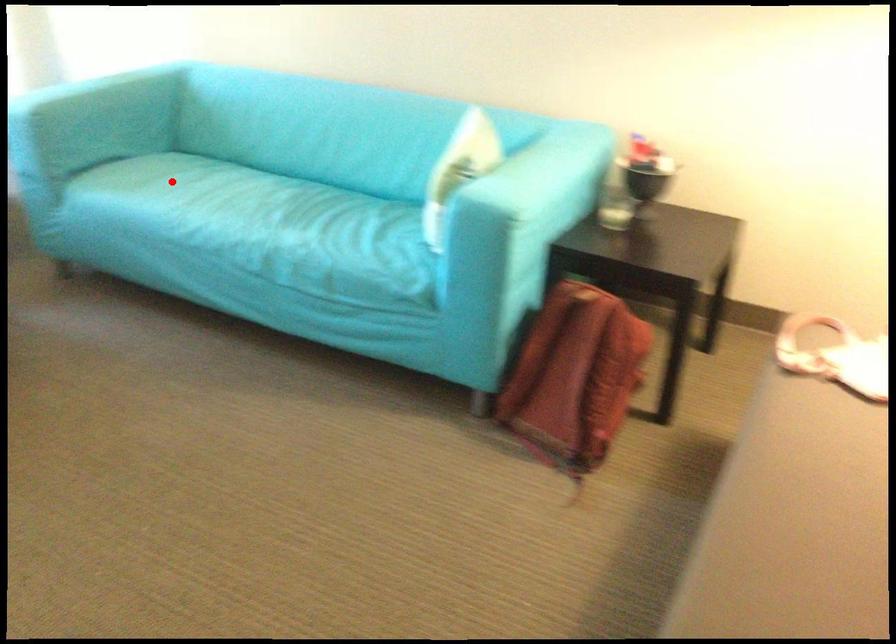
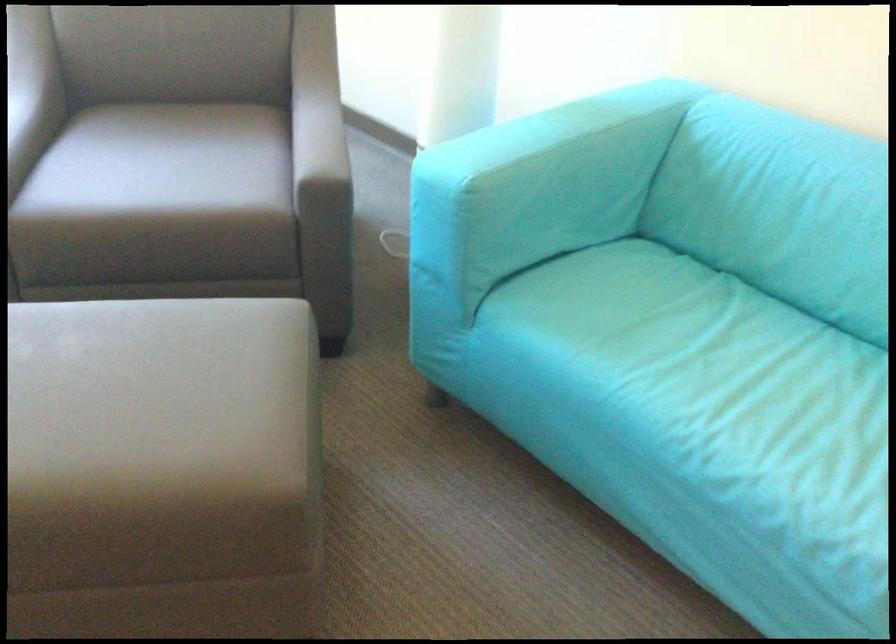
The point at the highlighted location is marked in the first image. Where is the corresponding point in the second image?

(699, 353)